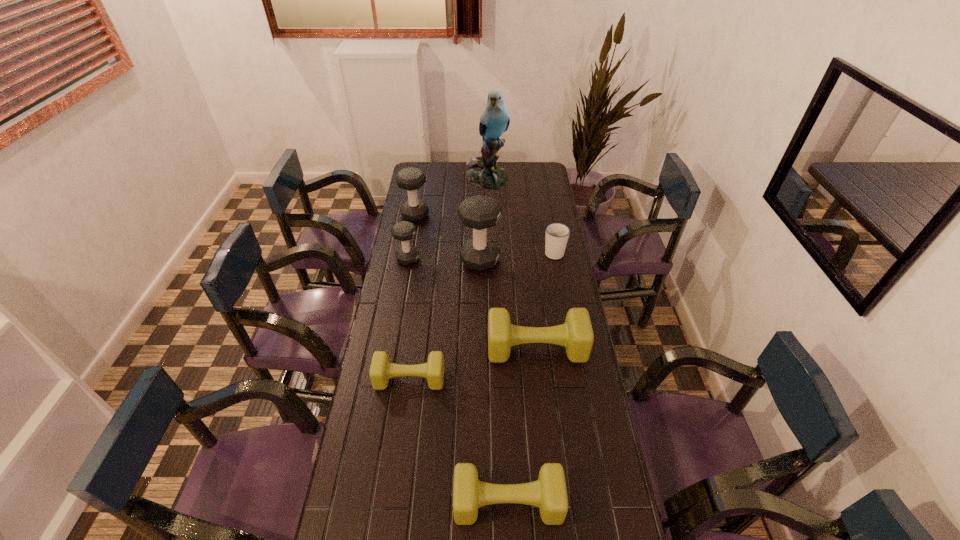
Where is `free space located 0.220m with a handle on the side of the white cup`? free space located 0.220m with a handle on the side of the white cup is located at coordinates (547, 216).

The height and width of the screenshot is (540, 960). Find the location of `blank space located with a handle on the side of the white cup`. blank space located with a handle on the side of the white cup is located at coordinates (551, 233).

Find the location of a particular element. The width and height of the screenshot is (960, 540). vacant area located on the left of the nearest object is located at coordinates (339, 503).

Where is `free spot located on the right of the shortest object`? The height and width of the screenshot is (540, 960). free spot located on the right of the shortest object is located at coordinates (536, 379).

Find the location of a particular element. Image resolution: width=960 pixels, height=540 pixels. object that is at the far edge is located at coordinates (483, 171).

Where is `dumbbell located at the right edge`? The width and height of the screenshot is (960, 540). dumbbell located at the right edge is located at coordinates (576, 335).

Find the location of a particular element. The width and height of the screenshot is (960, 540). cup located at the right edge is located at coordinates (557, 234).

In the image, there is a desktop. In order to click on vacant space at the far edge in this screenshot , I will do `click(449, 179)`.

Where is `vacant space at the left edge`? The width and height of the screenshot is (960, 540). vacant space at the left edge is located at coordinates (372, 443).

At what (x,y) coordinates should I click in order to perform the action: click on blank area at the right edge. Please return your answer as a coordinate pair (x, y). Looking at the image, I should click on click(594, 516).